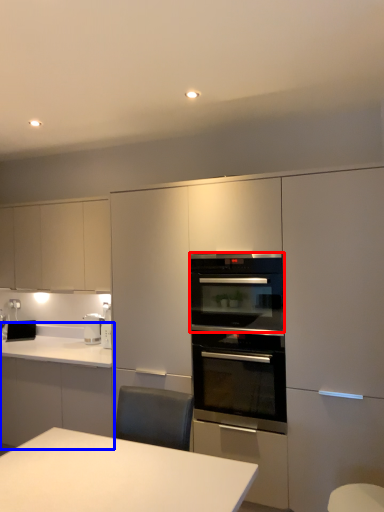
Question: Which object appears farthest to the camera in this image, oven (highlighted by a red box) or countertop (highlighted by a blue box)?

Choices:
 (A) oven
 (B) countertop

Answer: (B)